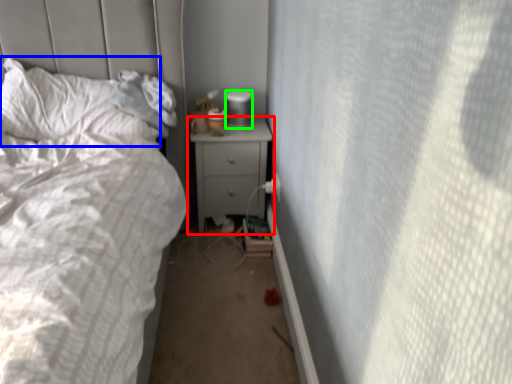
Question: Considering the real-world distances, which object is closest to nightstand (highlighted by a red box)? pillow (highlighted by a blue box) or gray (highlighted by a green box).

Choices:
 (A) pillow
 (B) gray

Answer: (B)